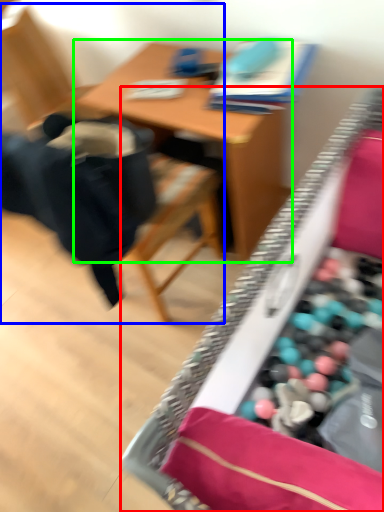
Question: Which is nearer to the desk (highlighted by a red box)? chair (highlighted by a blue box) or table (highlighted by a green box).

Choices:
 (A) chair
 (B) table

Answer: (B)